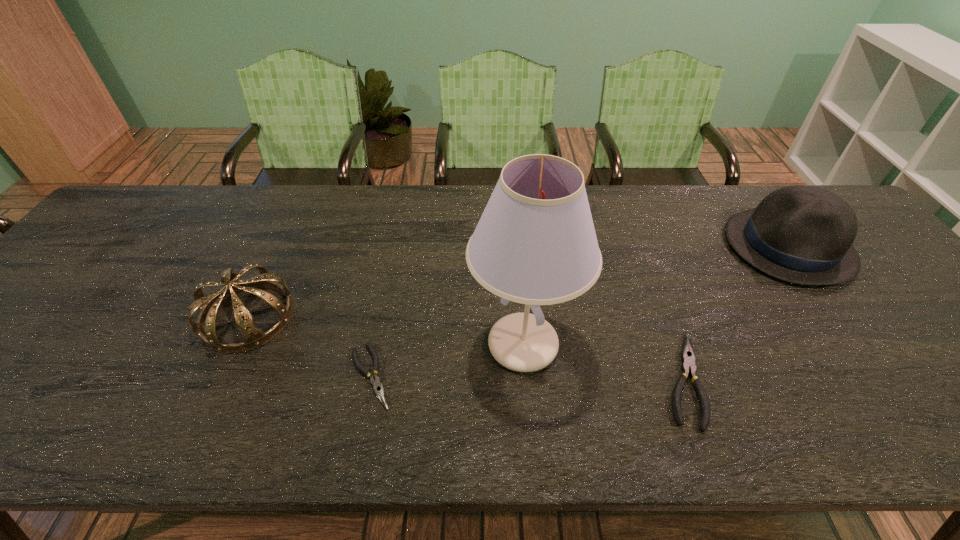
Where is `vacant space that is in between the rightmost object and the shorter pliers`? Image resolution: width=960 pixels, height=540 pixels. vacant space that is in between the rightmost object and the shorter pliers is located at coordinates (580, 311).

This screenshot has height=540, width=960. In order to click on vacant area that lies between the fourth object from left to right and the bowler hat in this screenshot , I will do `click(735, 313)`.

This screenshot has width=960, height=540. Find the location of `object that can be found as the second closest to the left pliers`. object that can be found as the second closest to the left pliers is located at coordinates (253, 337).

The image size is (960, 540). Identify the location of object that is the fourth closest to the shorter pliers. (801, 234).

Find the location of a particular element. the second closest pliers to the lampshade is located at coordinates point(688,357).

Identify the location of free space that satisfies the following two spatial constraints: 1. on the front side of the leftmost object; 2. on the right side of the shorter pliers. This screenshot has height=540, width=960. (221, 376).

At what (x,y) coordinates should I click in order to perform the action: click on vacant region that satisfies the following two spatial constraints: 1. on the front-facing side of the bowler hat; 2. on the front side of the shortest object. Please return your answer as a coordinate pair (x, y). Looking at the image, I should click on (881, 376).

Where is `vacant area that satisfies the following two spatial constraints: 1. on the front side of the shorter pliers; 2. on the left side of the fourth object from left to right`? Image resolution: width=960 pixels, height=540 pixels. vacant area that satisfies the following two spatial constraints: 1. on the front side of the shorter pliers; 2. on the left side of the fourth object from left to right is located at coordinates [371, 379].